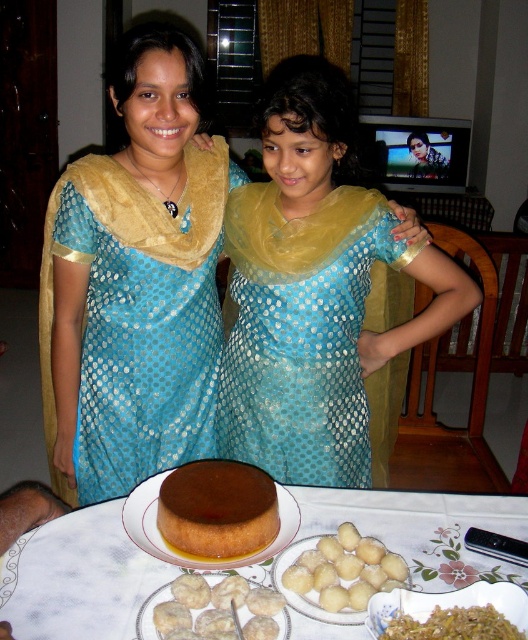
Question: Is blue dotted fabric dress at upper left to the right of white matte dumplings at center from the viewer's perspective?

Choices:
 (A) no
 (B) yes

Answer: (A)

Question: Where is matte blue dress at center located in relation to blue dotted fabric dress at center in the image?

Choices:
 (A) right
 (B) left

Answer: (B)

Question: Which point is farther to the camera?

Choices:
 (A) brown glossy cake at center
 (B) blue dotted fabric dress at upper left

Answer: (B)

Question: Can you confirm if blue dotted fabric dress at center is thinner than brown glossy rice at lower right?

Choices:
 (A) no
 (B) yes

Answer: (A)

Question: Among these objects, which one is nearest to the camera?

Choices:
 (A) white glossy dumplings at center
 (B) brown glossy rice at lower right

Answer: (B)

Question: Which object is positioned closest to the white matte dumplings at center?

Choices:
 (A) matte blue dress at center
 (B) white glossy dumplings at center
 (C) brown glossy cake at center
 (D) brown glossy rice at lower right

Answer: (C)